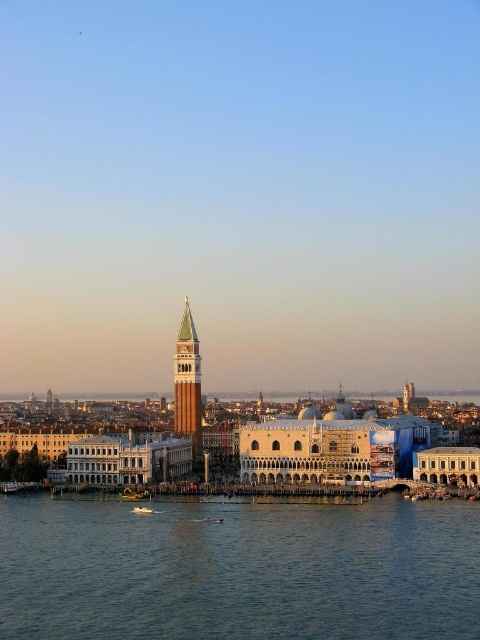
Question: Considering the relative positions of blue water at lower center and green glass bell tower at center in the image provided, where is blue water at lower center located with respect to green glass bell tower at center?

Choices:
 (A) right
 (B) left

Answer: (A)

Question: Can you confirm if green glass bell tower at center is thinner than white glossy boat at lower center?

Choices:
 (A) no
 (B) yes

Answer: (A)

Question: Among these objects, which one is nearest to the camera?

Choices:
 (A) blue water at lower center
 (B) white glossy boat at lower center

Answer: (A)

Question: Is blue water at lower center behind white glossy boat at lower center?

Choices:
 (A) no
 (B) yes

Answer: (A)

Question: Which of these objects is positioned closest to the white glossy boat at lower center?

Choices:
 (A) green glass bell tower at center
 (B) blue water at lower center

Answer: (B)

Question: Based on their relative distances, which object is farther from the white glossy boat at lower center?

Choices:
 (A) green glass bell tower at center
 (B) blue water at lower center

Answer: (A)